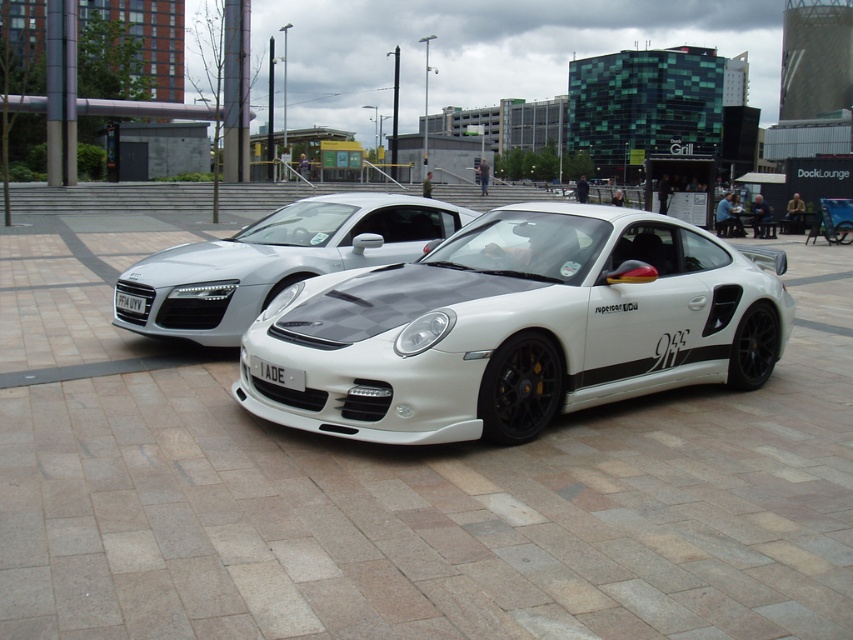
You are a delivery person trying to park your van between the two objects mentioned. Can you fit your van between the white matte sports car at center and the white plastic license plate at center?

The white matte sports car at center is bigger than the white plastic license plate at center, so there is enough space between them to fit your van.

You are standing in front of two sports cars. You see a point at coordinates (514, 326). Which car is this point located on?

The point at coordinates (514, 326) is located on the white matte sports car at center.